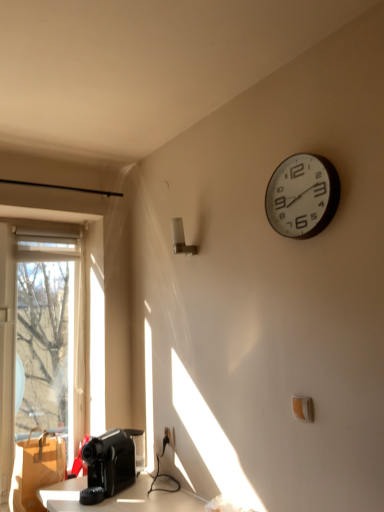
Question: Is the position of brown cardboard box at lower left less distant than that of black plastic coffee machine at lower left?

Choices:
 (A) no
 (B) yes

Answer: (A)

Question: Is brown cardboard box at lower left surrounding black plastic coffee machine at lower left?

Choices:
 (A) no
 (B) yes

Answer: (A)

Question: Is brown cardboard box at lower left far away from black plastic coffee machine at lower left?

Choices:
 (A) yes
 (B) no

Answer: (B)

Question: Can you confirm if brown cardboard box at lower left is taller than black plastic coffee machine at lower left?

Choices:
 (A) yes
 (B) no

Answer: (A)

Question: Is brown cardboard box at lower left positioned beyond the bounds of black plastic coffee machine at lower left?

Choices:
 (A) no
 (B) yes

Answer: (B)

Question: From the image's perspective, does brown cardboard box at lower left appear higher than black plastic coffee machine at lower left?

Choices:
 (A) no
 (B) yes

Answer: (A)

Question: Can you confirm if white plastic wall clock at upper right is positioned to the right of brown cardboard box at lower left?

Choices:
 (A) no
 (B) yes

Answer: (B)

Question: Is white plastic wall clock at upper right taller than brown cardboard box at lower left?

Choices:
 (A) yes
 (B) no

Answer: (B)

Question: From a real-world perspective, is white plastic wall clock at upper right located higher than brown cardboard box at lower left?

Choices:
 (A) no
 (B) yes

Answer: (B)

Question: Considering the relative sizes of white plastic wall clock at upper right and brown cardboard box at lower left in the image provided, is white plastic wall clock at upper right smaller than brown cardboard box at lower left?

Choices:
 (A) yes
 (B) no

Answer: (A)

Question: Is white plastic wall clock at upper right further to camera compared to brown cardboard box at lower left?

Choices:
 (A) no
 (B) yes

Answer: (A)

Question: Is white plastic wall clock at upper right oriented away from brown cardboard box at lower left?

Choices:
 (A) no
 (B) yes

Answer: (A)

Question: Is black plastic coffee machine at lower left closer to camera compared to brown cardboard box at lower left?

Choices:
 (A) no
 (B) yes

Answer: (B)